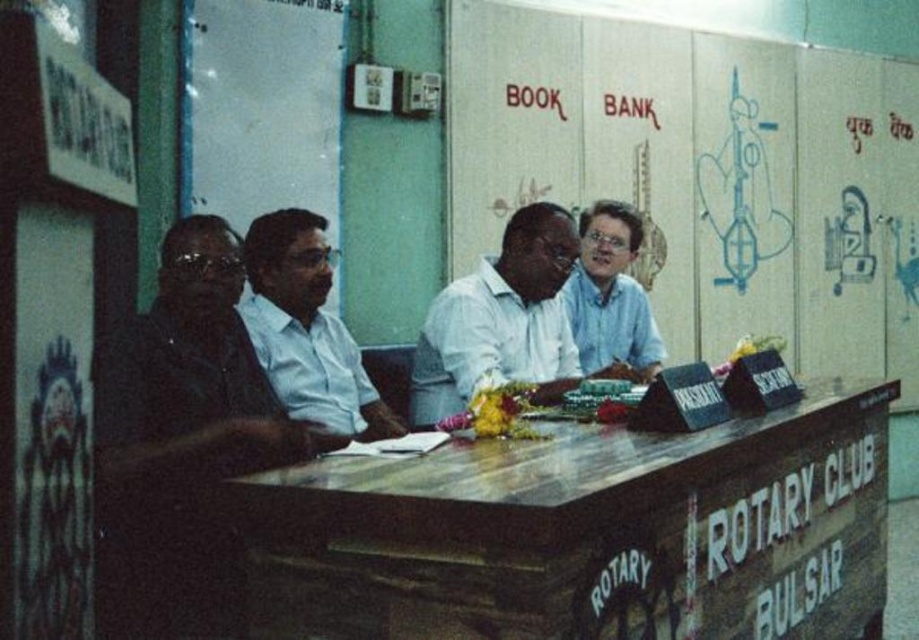
Who is positioned more to the left, matte white shirt at center or white shirt at center?

matte white shirt at center is more to the left.

What do you see at coordinates (307, 330) in the screenshot? The width and height of the screenshot is (919, 640). I see `matte white shirt at center` at bounding box center [307, 330].

Where is `matte white shirt at center`? matte white shirt at center is located at coordinates (307, 330).

The width and height of the screenshot is (919, 640). Identify the location of matte white shirt at center. (307, 330).

Does point (573, 467) lie behind point (648, 364)?

No.

Between wooden at center and white shirt at center, which one is positioned higher?

white shirt at center is above.

Is point (522, 561) farther from viewer compared to point (618, 243)?

No, it is not.

The height and width of the screenshot is (640, 919). What are the coordinates of `wooden at center` in the screenshot? It's located at (582, 532).

Is white matte shirt at center positioned in front of matte white shirt at center?

No, it is behind matte white shirt at center.

Is white matte shirt at center below matte white shirt at center?

Indeed, white matte shirt at center is positioned under matte white shirt at center.

Who is more forward, (550, 285) or (296, 346)?

Point (296, 346) is more forward.

Locate an element on the screen. Image resolution: width=919 pixels, height=640 pixels. white matte shirt at center is located at coordinates click(x=501, y=320).